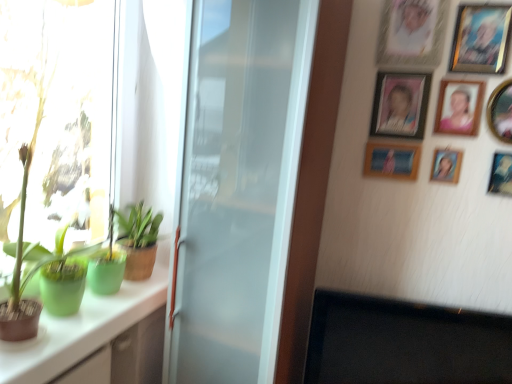
Where is `wooden picture frame at upper right, the sixth picture frame in the top-to-bottom sequence`? The height and width of the screenshot is (384, 512). wooden picture frame at upper right, the sixth picture frame in the top-to-bottom sequence is located at coordinates (392, 160).

What do you see at coordinates (238, 187) in the screenshot? The image size is (512, 384). I see `satin white refrigerator at center` at bounding box center [238, 187].

The height and width of the screenshot is (384, 512). I want to click on metallic gold picture frame at upper right, which is the fourth picture frame from bottom to top, so click(x=501, y=111).

Describe the element at coordinates (501, 174) in the screenshot. I see `metallic silver picture frame at upper right, the eighth picture frame when ordered from top to bottom` at that location.

You are a GUI agent. You are given a task and a screenshot of the screen. Output one action in this format:
    pyautogui.click(x=<x>, y=<y>)
    Task: Click on the metallic silver picture frame at upper right, arranged as the first picture frame when ordered from the bottom
    
    Given the screenshot: What is the action you would take?
    pyautogui.click(x=501, y=174)

In the scene shown: Measure the distance between wooden picture frame at upper right, the 7th picture frame from the top, and camera.

They are 4.57 feet apart.

Locate an element on the screen. green matte plant at left, the first houseplant from the bottom is located at coordinates (57, 261).

From their relative heights in the image, would you say green matte plant at left, the first houseplant from the bottom, is taller or shorter than wooden picture frame at upper right, the sixth picture frame in the top-to-bottom sequence?

In the image, green matte plant at left, the first houseplant from the bottom, appears to be taller than wooden picture frame at upper right, the sixth picture frame in the top-to-bottom sequence.

Is green matte plant at left, which is the 3th houseplant from top to bottom, aimed at wooden picture frame at upper right, the sixth picture frame in the top-to-bottom sequence?

No, green matte plant at left, which is the 3th houseplant from top to bottom, is not facing towards wooden picture frame at upper right, the sixth picture frame in the top-to-bottom sequence.

Between green matte plant at left, which is the 3th houseplant from top to bottom, and wooden picture frame at upper right, which is counted as the 3th picture frame, starting from the bottom, which one has smaller width?

wooden picture frame at upper right, which is counted as the 3th picture frame, starting from the bottom, is thinner.

Would you say green matte plant at left, the first houseplant from the bottom, is a long distance from wooden picture frame at upper right, which is counted as the 3th picture frame, starting from the bottom?

green matte plant at left, the first houseplant from the bottom, is far away from wooden picture frame at upper right, which is counted as the 3th picture frame, starting from the bottom.

Can you confirm if green matte plant at left, positioned as the second houseplant in bottom-to-top order, is positioned to the right of green matte plant at left, acting as the third houseplant starting from the bottom?

Yes.

Is green matte plant at left, the 2th houseplant when ordered from top to bottom, shorter than green matte plant at left, acting as the third houseplant starting from the bottom?

Yes, green matte plant at left, the 2th houseplant when ordered from top to bottom, is shorter than green matte plant at left, acting as the third houseplant starting from the bottom.

From the image's perspective, between green matte plant at left, positioned as the second houseplant in bottom-to-top order, and green matte plant at left, acting as the third houseplant starting from the bottom, which one is located above?

From the image's view, green matte plant at left, acting as the third houseplant starting from the bottom, is above.

Which is in front, point (151, 217) or point (12, 1)?

Point (12, 1)

What's the angular difference between green matte plant at left, positioned as the second houseplant in bottom-to-top order, and metallic silver photo frame at upper right, which appears as the eighth picture frame when ordered from the bottom,'s facing directions?

There is a 91.7-degree angle between the facing directions of green matte plant at left, positioned as the second houseplant in bottom-to-top order, and metallic silver photo frame at upper right, which appears as the eighth picture frame when ordered from the bottom.

Could you tell me if green matte plant at left, positioned as the second houseplant in bottom-to-top order, is turned towards metallic silver photo frame at upper right, which appears as the eighth picture frame when ordered from the bottom?

No.

Which object is wider, green matte plant at left, the 2th houseplant when ordered from top to bottom, or metallic silver photo frame at upper right, which appears as the eighth picture frame when ordered from the bottom?

With larger width is green matte plant at left, the 2th houseplant when ordered from top to bottom.

Considering the relative positions of green matte plant at left, the 2th houseplant when ordered from top to bottom, and metallic silver photo frame at upper right, which appears as the eighth picture frame when ordered from the bottom, in the image provided, is green matte plant at left, the 2th houseplant when ordered from top to bottom, to the left of metallic silver photo frame at upper right, which appears as the eighth picture frame when ordered from the bottom, from the viewer's perspective?

Yes.

Does point (461, 127) come behind point (311, 32)?

Yes, it is.

Is matte plastic picture frame at upper right, the 5th picture frame in the bottom-to-top sequence, positioned beyond the bounds of satin white refrigerator at center?

Yes, matte plastic picture frame at upper right, the 5th picture frame in the bottom-to-top sequence, is outside of satin white refrigerator at center.

From the image's perspective, between matte plastic picture frame at upper right, the 4th picture frame viewed from the top, and satin white refrigerator at center, which one is located above?

matte plastic picture frame at upper right, the 4th picture frame viewed from the top.

Between satin white refrigerator at center and metallic silver picture frame at upper right, the eighth picture frame when ordered from top to bottom, which one is positioned in front?

satin white refrigerator at center is in front.

From the image's perspective, does satin white refrigerator at center appear higher than metallic silver picture frame at upper right, the eighth picture frame when ordered from top to bottom?

Incorrect, from the image's perspective, satin white refrigerator at center is lower than metallic silver picture frame at upper right, the eighth picture frame when ordered from top to bottom.

Considering the relative sizes of satin white refrigerator at center and metallic silver picture frame at upper right, arranged as the first picture frame when ordered from the bottom, in the image provided, is satin white refrigerator at center shorter than metallic silver picture frame at upper right, arranged as the first picture frame when ordered from the bottom,?

In fact, satin white refrigerator at center may be taller than metallic silver picture frame at upper right, arranged as the first picture frame when ordered from the bottom.

Could you tell me if green matte plant at left, the 2th houseplant when ordered from top to bottom, is facing white glossy cabinet at left?

No, green matte plant at left, the 2th houseplant when ordered from top to bottom, is not aimed at white glossy cabinet at left.

Locate an element on the screen. Image resolution: width=512 pixels, height=384 pixels. cabinetry in front of the green matte plant at left, the 2th houseplant when ordered from top to bottom is located at coordinates (81, 330).

Is green matte plant at left, the 2th houseplant when ordered from top to bottom, closer to the viewer compared to white glossy cabinet at left?

No, green matte plant at left, the 2th houseplant when ordered from top to bottom, is further to the viewer.

From the image's perspective, is green matte plant at left, the 2th houseplant when ordered from top to bottom, on top of white glossy cabinet at left?

Yes.

Would you say wooden picture frame at upper right, which is counted as the 3th picture frame, starting from the bottom, is outside green matte plant at left, positioned as the second houseplant in bottom-to-top order?

Absolutely, wooden picture frame at upper right, which is counted as the 3th picture frame, starting from the bottom, is external to green matte plant at left, positioned as the second houseplant in bottom-to-top order.

Considering the points (370, 142) and (128, 244), which point is in front, point (370, 142) or point (128, 244)?

The point (370, 142) is closer.

Which of these two, wooden picture frame at upper right, which is counted as the 3th picture frame, starting from the bottom, or green matte plant at left, the 2th houseplant when ordered from top to bottom, is wider?

green matte plant at left, the 2th houseplant when ordered from top to bottom.

Who is more distant, wooden picture frame at upper right, the sixth picture frame in the top-to-bottom sequence, or green matte plant at left, positioned as the second houseplant in bottom-to-top order?

green matte plant at left, positioned as the second houseplant in bottom-to-top order, is more distant.

Find the location of `the 2nd houseplant positioned below the wooden picture frame at upper right, the sixth picture frame in the top-to-bottom sequence (from a real-world perspective)`. the 2nd houseplant positioned below the wooden picture frame at upper right, the sixth picture frame in the top-to-bottom sequence (from a real-world perspective) is located at coordinates [x=57, y=261].

Where is `houseplant on the right of green matte plant at left, acting as the 1th houseplant starting from the top`? This screenshot has width=512, height=384. houseplant on the right of green matte plant at left, acting as the 1th houseplant starting from the top is located at coordinates (138, 240).

Estimate the real-world distances between objects in this image. Which object is further from metallic gold picture frame at upper right, the fifth picture frame positioned from the top, green matte plant at left, acting as the 1th houseplant starting from the top, or green matte plant at left, the 2th houseplant when ordered from top to bottom?

The object further to metallic gold picture frame at upper right, the fifth picture frame positioned from the top, is green matte plant at left, acting as the 1th houseplant starting from the top.

Considering their positions, is green matte plant at left, acting as the third houseplant starting from the bottom, positioned closer to wooden picture frame at upper right, which is the seventh picture frame from bottom to top, than matte plastic picture frame at upper right, the 4th picture frame viewed from the top?

The object closer to wooden picture frame at upper right, which is the seventh picture frame from bottom to top, is matte plastic picture frame at upper right, the 4th picture frame viewed from the top.

Looking at the image, which one is located closer to metallic gold picture frame at upper right, the fifth picture frame positioned from the top, wooden picture frame at upper right, positioned as the second picture frame in bottom-to-top order, or metallic silver photo frame at upper right, which appears as the eighth picture frame when ordered from the bottom?

The object closer to metallic gold picture frame at upper right, the fifth picture frame positioned from the top, is wooden picture frame at upper right, positioned as the second picture frame in bottom-to-top order.

Considering their positions, is matte plastic picture frame at upper right, the 4th picture frame viewed from the top, positioned closer to wooden photo frame at upper right, the 3th picture frame when ordered from top to bottom, than green matte plant at left, the first houseplant from the bottom?

matte plastic picture frame at upper right, the 4th picture frame viewed from the top, is positioned closer to the anchor wooden photo frame at upper right, the 3th picture frame when ordered from top to bottom.

Looking at the image, which one is located closer to green matte plant at left, the first houseplant from the bottom, wooden picture frame at upper right, which is the seventh picture frame from bottom to top, or wooden photo frame at upper right, which is the 6th picture frame from bottom to top?

wooden photo frame at upper right, which is the 6th picture frame from bottom to top.

Which object lies further to the anchor point metallic silver photo frame at upper right, which appears as the eighth picture frame when ordered from the bottom, wooden photo frame at upper right, which is the 6th picture frame from bottom to top, or green matte plant at left, which is the 3th houseplant from top to bottom?

green matte plant at left, which is the 3th houseplant from top to bottom, lies further to metallic silver photo frame at upper right, which appears as the eighth picture frame when ordered from the bottom, than the other object.

Based on the photo, from the image, which object appears to be farther from wooden photo frame at upper right, which is the 6th picture frame from bottom to top, metallic gold picture frame at upper right, which is the fourth picture frame from bottom to top, or green matte plant at left, the first houseplant from the bottom?

green matte plant at left, the first houseplant from the bottom, is positioned further to the anchor wooden photo frame at upper right, which is the 6th picture frame from bottom to top.

Estimate the real-world distances between objects in this image. Which object is closer to wooden photo frame at upper right, which is the 6th picture frame from bottom to top, white glossy cabinet at left or matte plastic picture frame at upper right, the 4th picture frame viewed from the top?

matte plastic picture frame at upper right, the 4th picture frame viewed from the top, is positioned closer to the anchor wooden photo frame at upper right, which is the 6th picture frame from bottom to top.

Locate an element on the screen. The width and height of the screenshot is (512, 384). picture frame located between green matte plant at left, acting as the third houseplant starting from the bottom, and wooden photo frame at upper right, the 3th picture frame when ordered from top to bottom, in the left-right direction is located at coordinates (392, 160).

Locate an element on the screen. cabinetry located between green matte plant at left, acting as the third houseplant starting from the bottom, and satin white refrigerator at center in the left-right direction is located at coordinates click(81, 330).

The height and width of the screenshot is (384, 512). In order to click on door between green matte plant at left, positioned as the second houseplant in bottom-to-top order, and wooden photo frame at upper right, which is the 6th picture frame from bottom to top, from left to right in this screenshot , I will do `click(238, 187)`.

Locate an element on the screen. The height and width of the screenshot is (384, 512). houseplant situated between green matte plant at left, acting as the third houseplant starting from the bottom, and wooden picture frame at upper right, the sixth picture frame in the top-to-bottom sequence, from left to right is located at coordinates (138, 240).